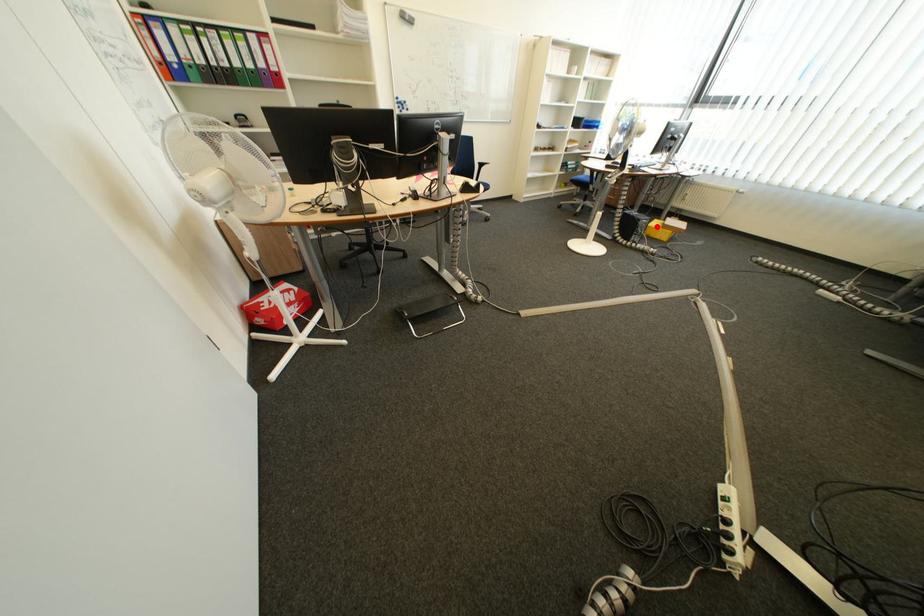
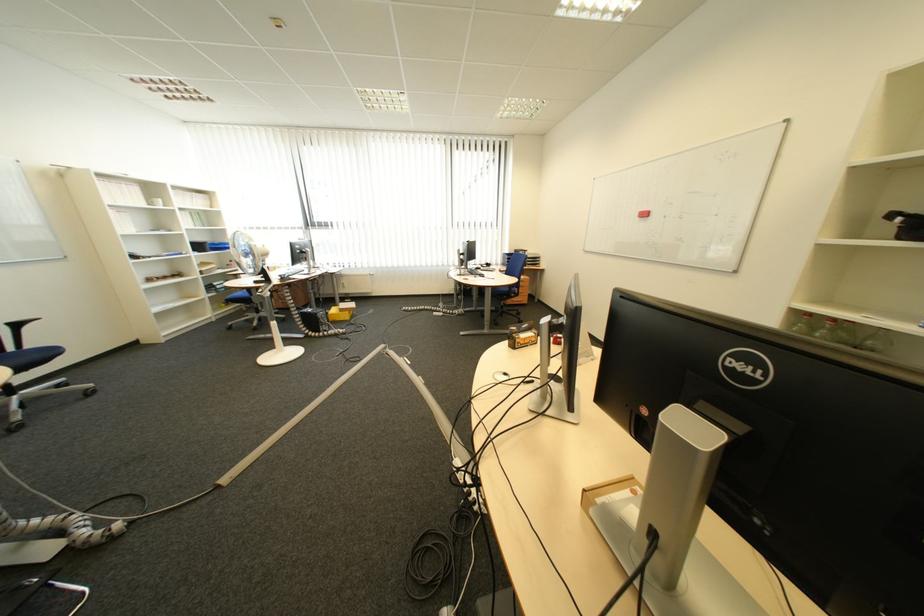
Find the pixel in the second image that matches the highlighted location in the first image.

(335, 317)